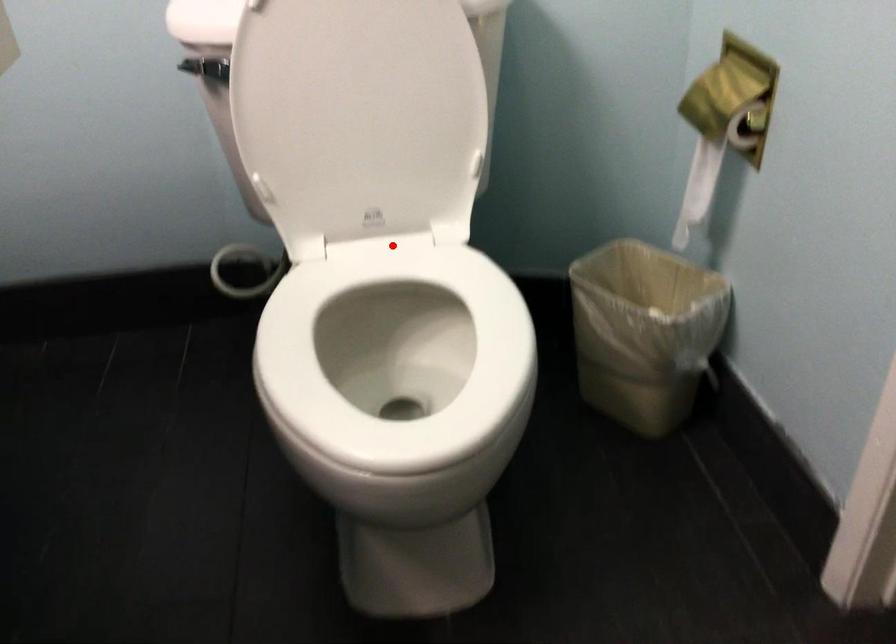
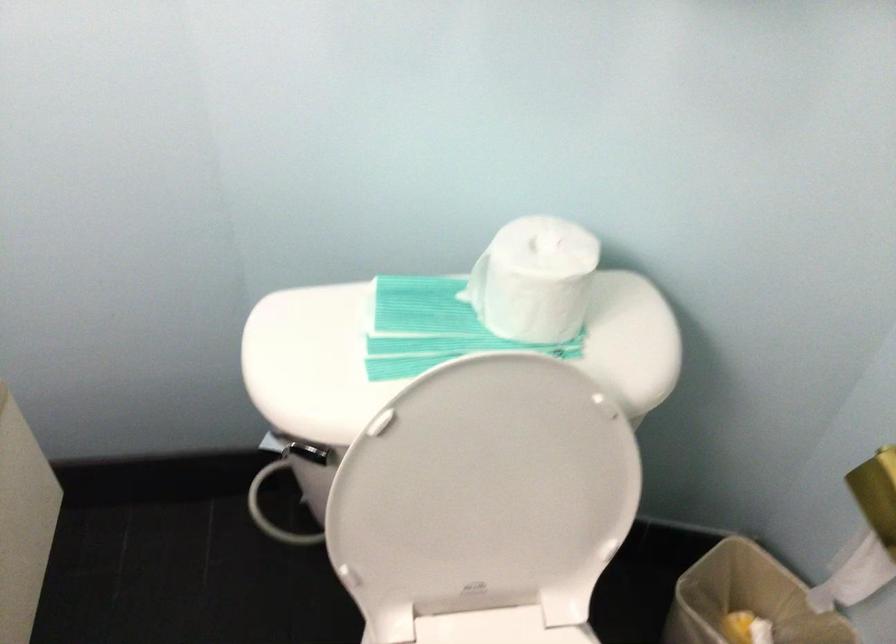
Question: I am providing you with two images of the same scene from different viewpoints. A red point is shown in image1. For the corresponding object point in image2, is it positioned nearer or farther from the camera?

Choices:
 (A) Nearer
 (B) Farther

Answer: (A)